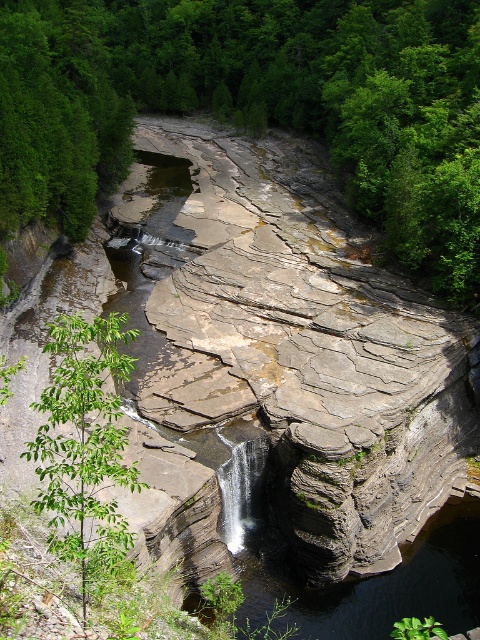
Is green leafy tree at center-left to the left of green leafy tree at lower left from the viewer's perspective?

Yes, green leafy tree at center-left is to the left of green leafy tree at lower left.

Which is below, green leafy tree at center-left or green leafy tree at lower left?

green leafy tree at lower left

Where is `green leafy tree at center-left`? The height and width of the screenshot is (640, 480). green leafy tree at center-left is located at coordinates (254, 106).